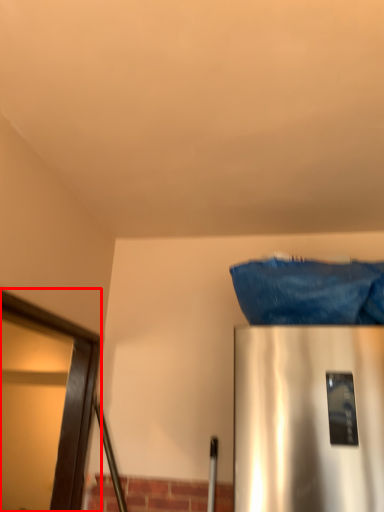
Question: From the image's perspective, considering the relative positions of glass door (annotated by the red box) and material in the image provided, where is glass door (annotated by the red box) located with respect to the staircase?

Choices:
 (A) above
 (B) below

Answer: (B)